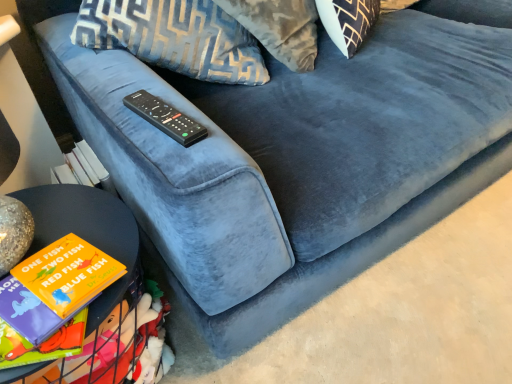
Describe the element at coordinates (86, 231) in the screenshot. The width and height of the screenshot is (512, 384). I see `matte black table at lower left` at that location.

In order to click on matte black table at lower left in this screenshot , I will do `click(86, 231)`.

Image resolution: width=512 pixels, height=384 pixels. What do you see at coordinates (165, 118) in the screenshot? I see `black plastic remote at center` at bounding box center [165, 118].

Measure the distance between point (181, 124) and camera.

Point (181, 124) and camera are 28.46 inches apart from each other.

This screenshot has height=384, width=512. What are the coordinates of `black plastic remote at center` in the screenshot? It's located at coord(165,118).

Find the location of a particular element. matte black table at lower left is located at coordinates (86, 231).

Looking at this image, is black plastic remote at center to the right of matte black table at lower left from the viewer's perspective?

Yes.

Is black plastic remote at center closer to the viewer compared to matte black table at lower left?

No, the depth of black plastic remote at center is greater than that of matte black table at lower left.

Which is less distant, (x=133, y=99) or (x=106, y=313)?

Point (x=106, y=313)

From the image's perspective, between black plastic remote at center and matte black table at lower left, who is located below?

matte black table at lower left is shown below in the image.

From a real-world perspective, is black plastic remote at center on matte black table at lower left?

Yes.

Can you confirm if black plastic remote at center is thinner than matte black table at lower left?

Yes, black plastic remote at center is thinner than matte black table at lower left.

Considering the sizes of black plastic remote at center and matte black table at lower left in the image, is black plastic remote at center taller or shorter than matte black table at lower left?

In the image, black plastic remote at center appears to be shorter than matte black table at lower left.

Between black plastic remote at center and matte black table at lower left, which one has larger size?

Bigger between the two is matte black table at lower left.

Choose the correct answer: Is black plastic remote at center inside matte black table at lower left or outside it?

black plastic remote at center is not inside matte black table at lower left, it's outside.

Is black plastic remote at center not near matte black table at lower left?

No.

Is black plastic remote at center looking in the opposite direction of matte black table at lower left?

No.

Can you tell me how much black plastic remote at center and matte black table at lower left differ in facing direction?

There is a 28.2-degree angle between the facing directions of black plastic remote at center and matte black table at lower left.

Measure the distance between black plastic remote at center and matte black table at lower left.

9.54 inches.

Identify the location of remote on the right of the matte black table at lower left. (165, 118).

Is matte black table at lower left at the left side of black plastic remote at center?

Correct, you'll find matte black table at lower left to the left of black plastic remote at center.

Considering their positions, is matte black table at lower left located in front of or behind black plastic remote at center?

matte black table at lower left is in front of black plastic remote at center.

Is point (113, 229) positioned behind point (148, 96)?

No, it is in front of (148, 96).

From the image's perspective, is matte black table at lower left positioned above or below black plastic remote at center?

Based on their image positions, matte black table at lower left is located beneath black plastic remote at center.

From a real-world perspective, relative to black plastic remote at center, is matte black table at lower left vertically above or below?

From a real-world perspective, matte black table at lower left is physically below black plastic remote at center.

Is matte black table at lower left thinner than black plastic remote at center?

In fact, matte black table at lower left might be wider than black plastic remote at center.

Between matte black table at lower left and black plastic remote at center, which one has more height?

matte black table at lower left is taller.

Based on the photo, in terms of size, does matte black table at lower left appear bigger or smaller than black plastic remote at center?

Considering their sizes, matte black table at lower left takes up more space than black plastic remote at center.

In the scene shown: Is matte black table at lower left completely or partially outside of black plastic remote at center?

Absolutely, matte black table at lower left is external to black plastic remote at center.

Are matte black table at lower left and black plastic remote at center making contact?

No, matte black table at lower left is not in contact with black plastic remote at center.

Is matte black table at lower left looking in the opposite direction of black plastic remote at center?

matte black table at lower left does not have its back to black plastic remote at center.

Consider the image. Can you tell me how much matte black table at lower left and black plastic remote at center differ in facing direction?

The angle between the facing direction of matte black table at lower left and the facing direction of black plastic remote at center is 28.2 degrees.

What are the coordinates of `table located on the left of black plastic remote at center` in the screenshot? It's located at (86, 231).

The width and height of the screenshot is (512, 384). What are the coordinates of `remote that is behind the matte black table at lower left` in the screenshot? It's located at (165, 118).

Identify the location of remote lying above the matte black table at lower left (from the image's perspective). This screenshot has width=512, height=384. (165, 118).